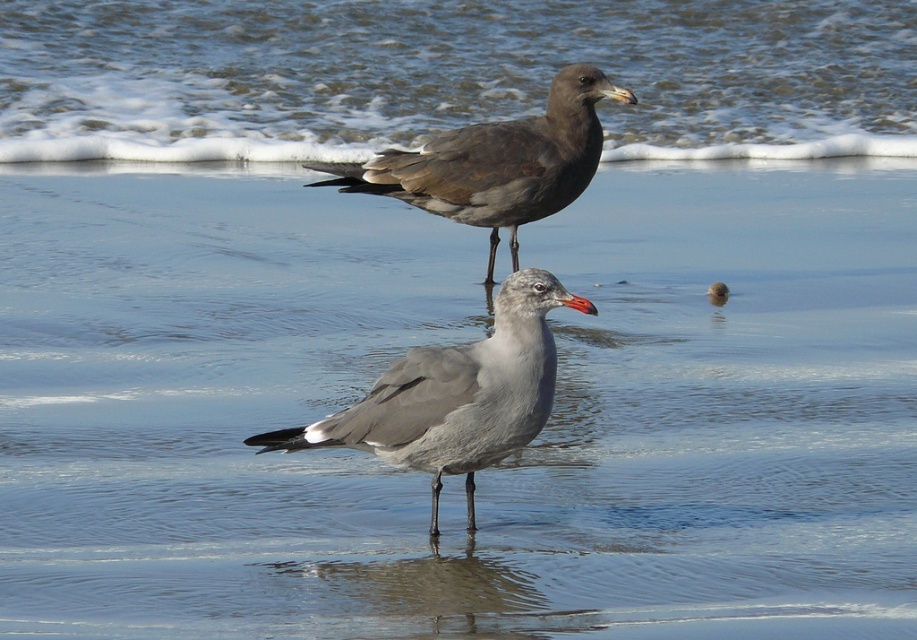
You are standing at the edge of the beach and see the gray matte seagull at center. If you want to walk directly towards it, which direction should you move relative to your current position?

Since the gray matte seagull at center is located at point (455, 396), you should move towards the center of the beach to reach it.

You are a photographer trying to capture both the clear water at upper center and the dark brown feathers at upper center in a single shot. Based on their positions, which object should you adjust your camera focus to first to ensure both are in frame?

The clear water at upper center is to the right of dark brown feathers at upper center. To capture both in a single shot, adjust your camera focus to the dark brown feathers at upper center first since it is on the left side, then pan right to include the clear water at upper center in the frame.